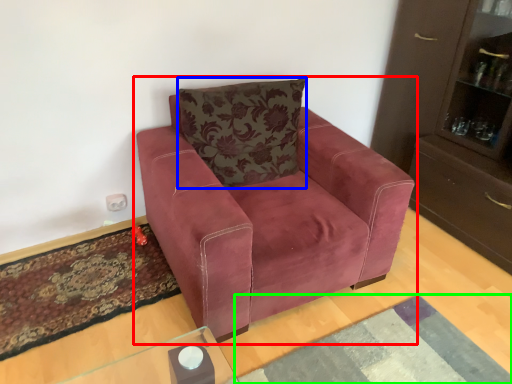
Question: Which object is positioned closest to chair (highlighted by a red box)? Select from pillow (highlighted by a blue box) and mat (highlighted by a green box).

Choices:
 (A) pillow
 (B) mat

Answer: (A)